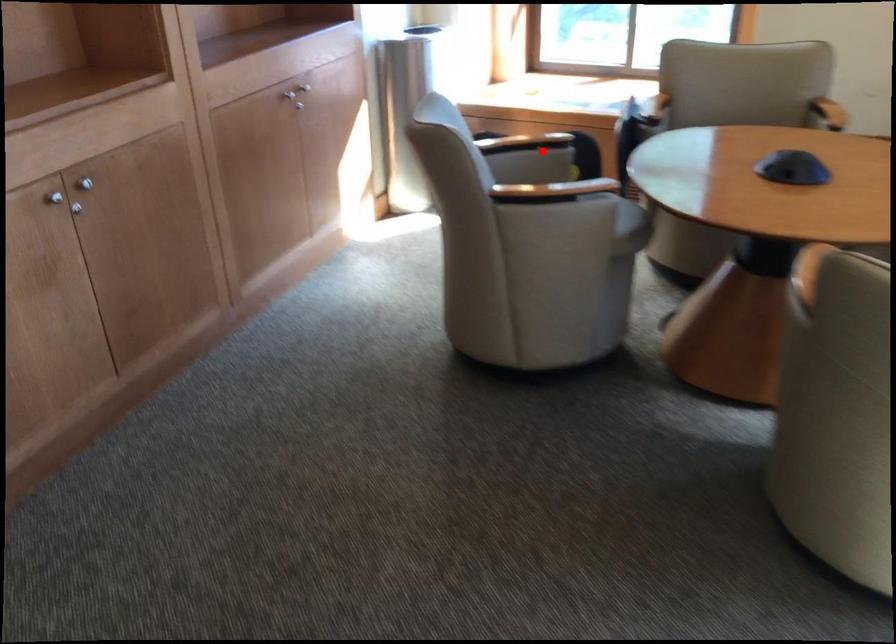
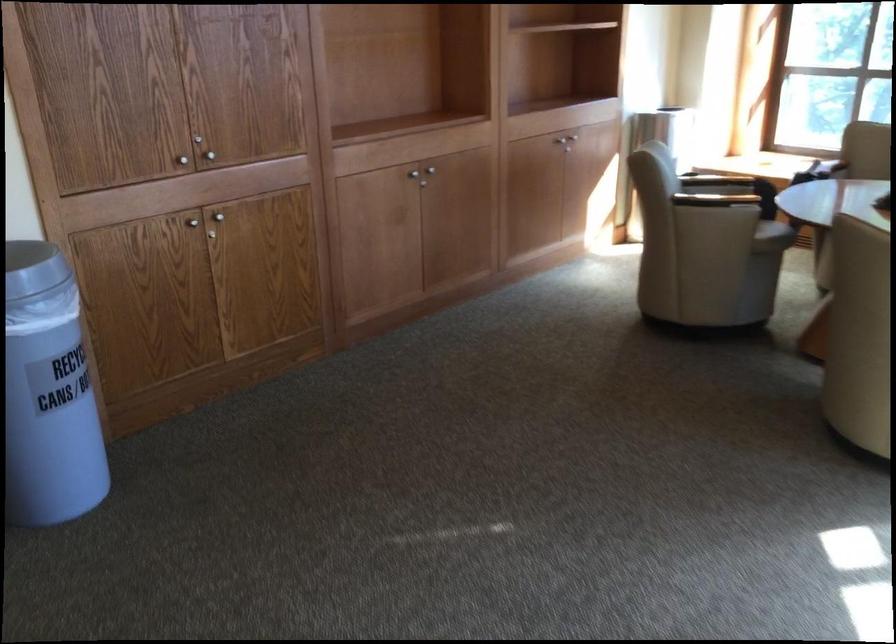
Question: I am providing you with two images of the same scene from different viewpoints. A red point is shown in image1. For the corresponding object point in image2, is it positioned nearer or farther from the camera?

Choices:
 (A) Nearer
 (B) Farther

Answer: (B)